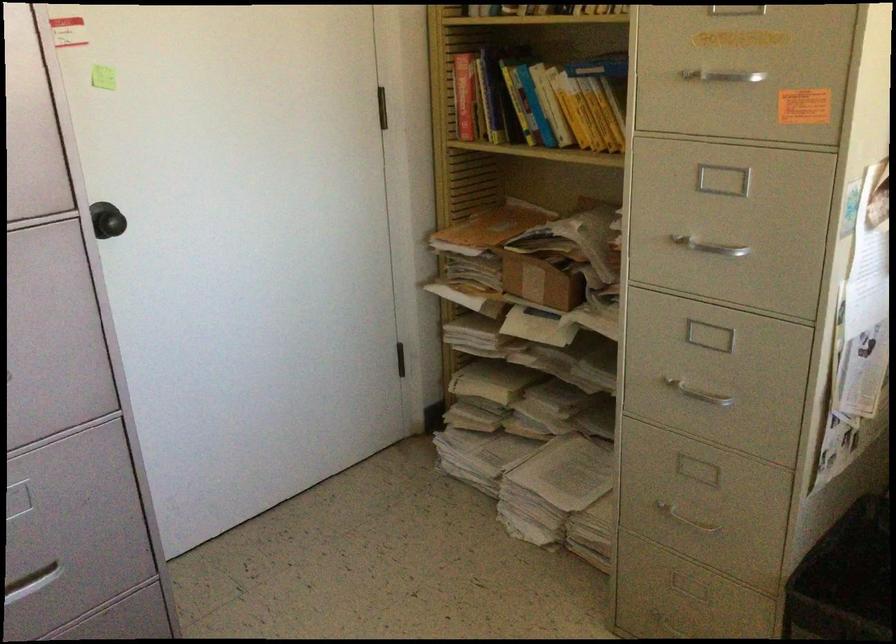
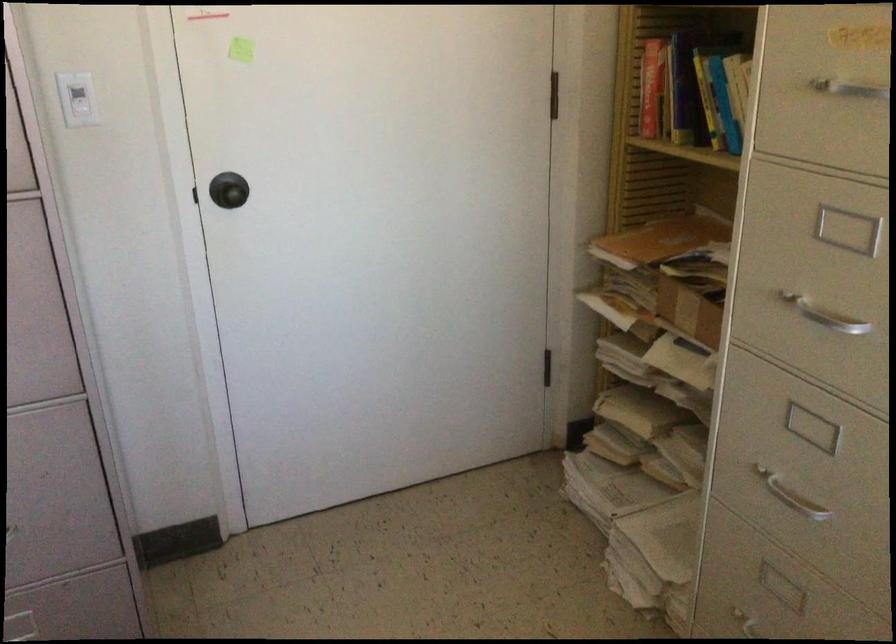
Find the pixel in the second image that matches point 467,98 in the first image.

(650, 88)